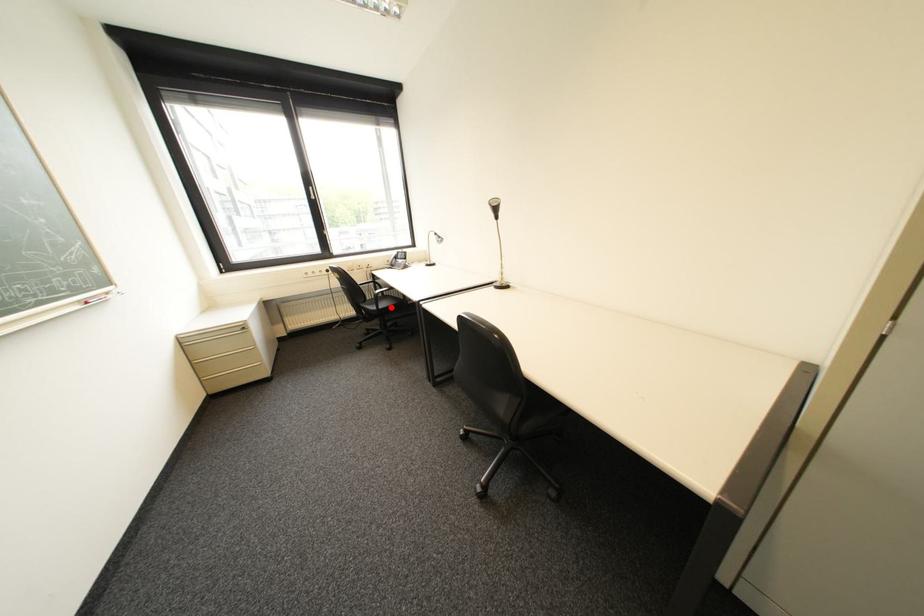
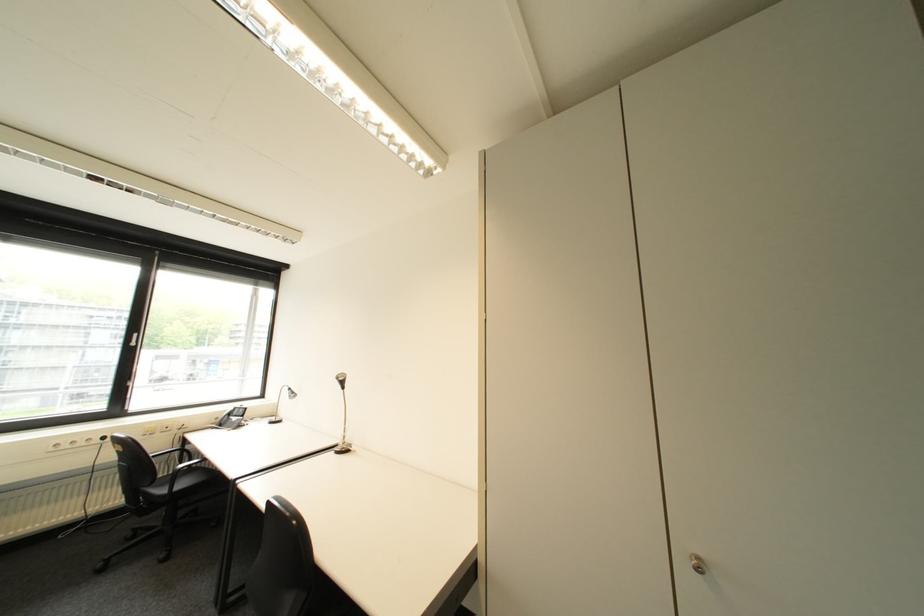
Question: I am providing you with two images of the same scene from different viewpoints. Given a red point in image1, look at the same physical point in image2. Is it:

Choices:
 (A) Closer to the viewpoint
 (B) Farther from the viewpoint

Answer: (B)